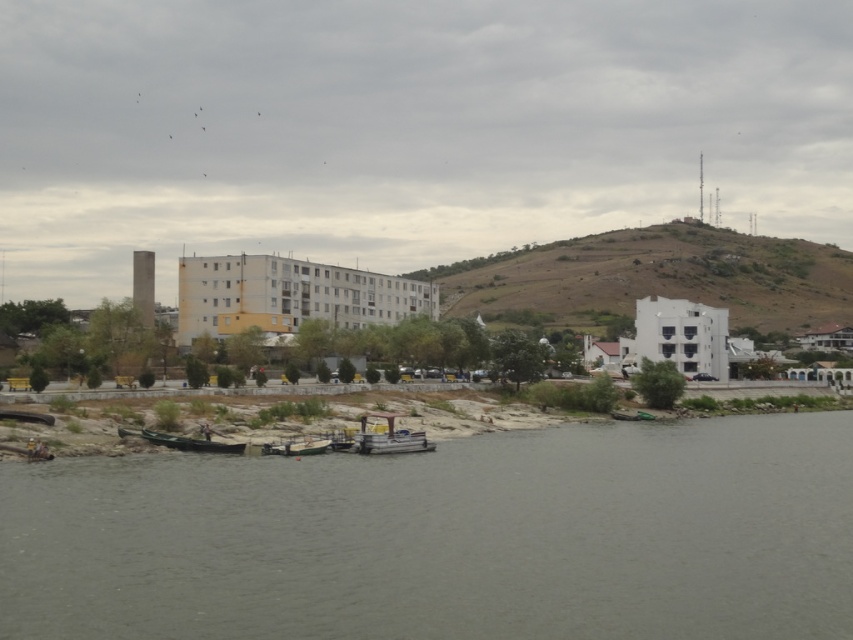
Question: Among these points, which one is farthest from the camera?

Choices:
 (A) (x=817, y=301)
 (B) (x=158, y=438)
 (C) (x=306, y=444)

Answer: (A)

Question: Where is gray concrete river at lower center located in relation to metallic gray boat at center in the image?

Choices:
 (A) right
 (B) left

Answer: (A)

Question: Which of the following is the closest to the observer?

Choices:
 (A) 283,448
 (B) 589,298

Answer: (A)

Question: Can you confirm if green matte boat at lower left is positioned to the left of wooden boat at lower center?

Choices:
 (A) no
 (B) yes

Answer: (B)

Question: Is green matte boat at lower left closer to the viewer compared to wooden boat at lower center?

Choices:
 (A) yes
 (B) no

Answer: (A)

Question: Which point is closer to the camera?

Choices:
 (A) brown/dry grass hillside at center-right
 (B) wooden boat at lower center

Answer: (B)